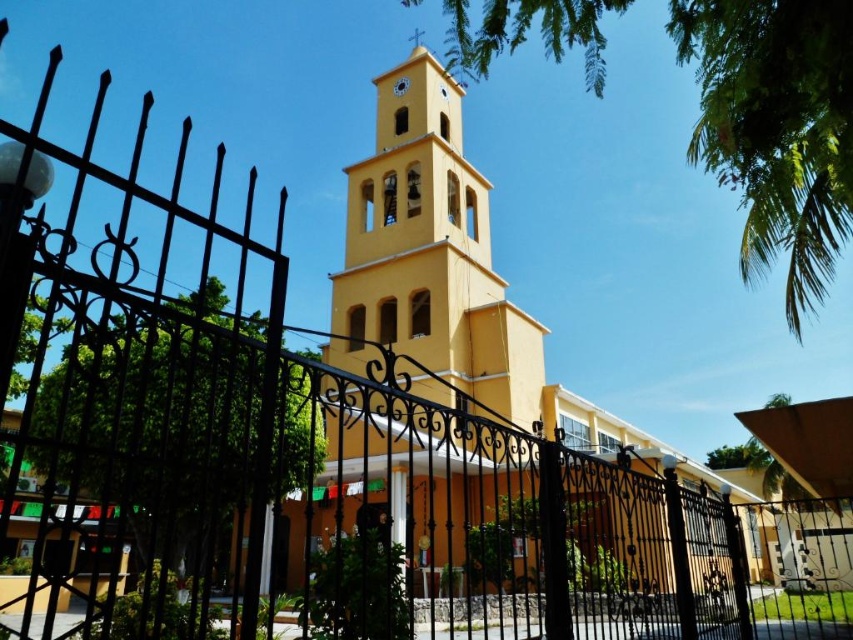
Question: Which of the following is the farthest from the observer?

Choices:
 (A) (395, 90)
 (B) (438, 352)

Answer: (A)

Question: Considering the relative positions of yellow matte bell tower at center and matte yellow clock at upper center in the image provided, where is yellow matte bell tower at center located with respect to matte yellow clock at upper center?

Choices:
 (A) right
 (B) left

Answer: (A)

Question: Can you confirm if yellow matte bell tower at center is wider than matte yellow clock at upper center?

Choices:
 (A) no
 (B) yes

Answer: (B)

Question: Is yellow matte bell tower at center wider than matte yellow clock at upper center?

Choices:
 (A) no
 (B) yes

Answer: (B)

Question: Among these points, which one is farthest from the camera?

Choices:
 (A) (407, 81)
 (B) (381, 358)

Answer: (A)

Question: Among these objects, which one is farthest from the camera?

Choices:
 (A) matte yellow clock at upper center
 (B) yellow matte bell tower at center

Answer: (A)